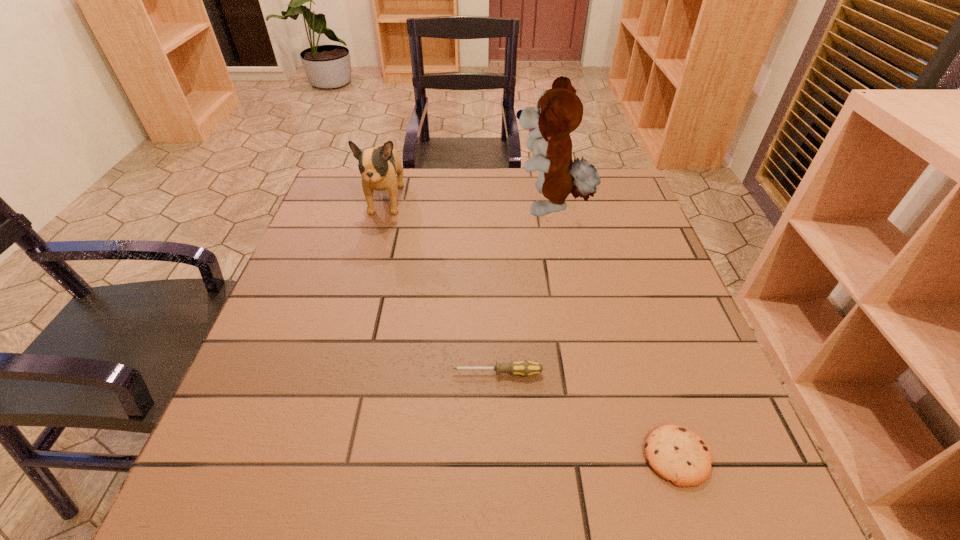
Where is `the right puppy`? the right puppy is located at coordinates (559, 111).

Find the location of a particular element. the taller puppy is located at coordinates (559, 111).

Locate an element on the screen. The image size is (960, 540). the left puppy is located at coordinates (378, 166).

Locate an element on the screen. the shorter puppy is located at coordinates (378, 166).

Locate an element on the screen. This screenshot has height=540, width=960. screwdriver is located at coordinates (525, 368).

Find the location of a particular element. the nearest object is located at coordinates (676, 454).

This screenshot has height=540, width=960. Identify the location of blank space located on the face of the tallest object. (415, 207).

Find the location of a particular element. This screenshot has height=540, width=960. free space located on the face of the tallest object is located at coordinates (429, 207).

I want to click on free location located 0.070m on the face of the tallest object, so click(487, 207).

Identify the location of vacant space located 0.270m at the face of the left puppy. The width and height of the screenshot is (960, 540). pyautogui.click(x=359, y=301).